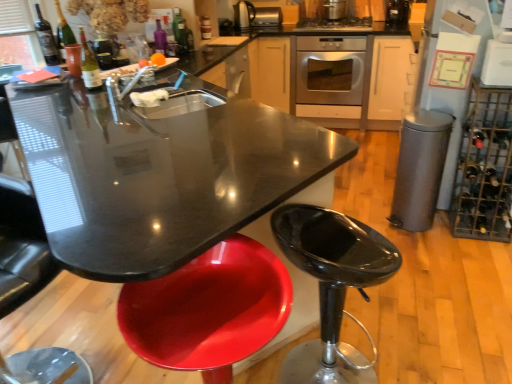
At what (x,y) coordinates should I click in order to perform the action: click on free space between metallic wire wine rack at right and metallic gray trash can at right, the 4th appliance when ordered from left to right. Please return your answer as a coordinate pair (x, y). The height and width of the screenshot is (384, 512). Looking at the image, I should click on (434, 232).